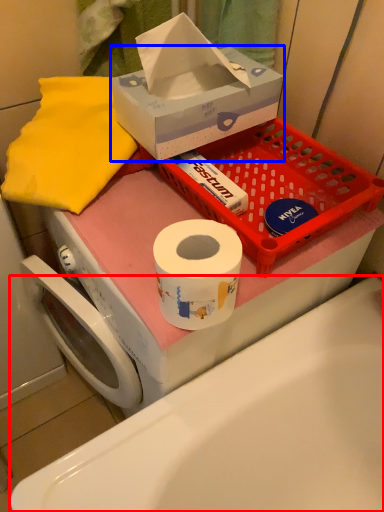
Question: Among these objects, which one is farthest to the camera, bath (highlighted by a red box) or box (highlighted by a blue box)?

Choices:
 (A) bath
 (B) box

Answer: (B)